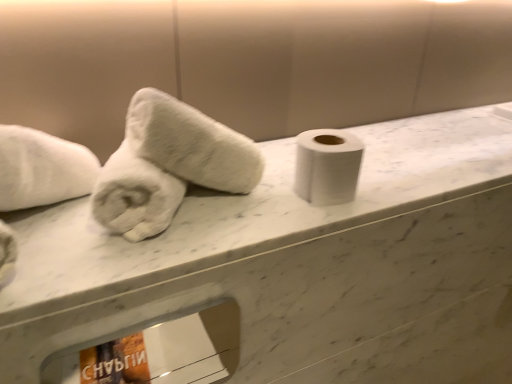
Find the location of a particular element. vacant space that's between white matte toilet paper at center and white fluffy towel at left, the 1th towel in the right-to-left sequence is located at coordinates (264, 205).